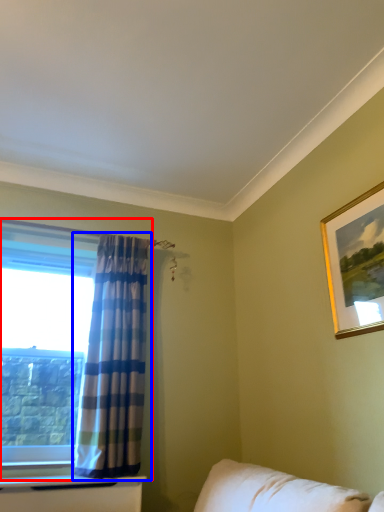
Question: Which of the following is the farthest to the observer, window (highlighted by a red box) or curtain (highlighted by a blue box)?

Choices:
 (A) window
 (B) curtain

Answer: (A)